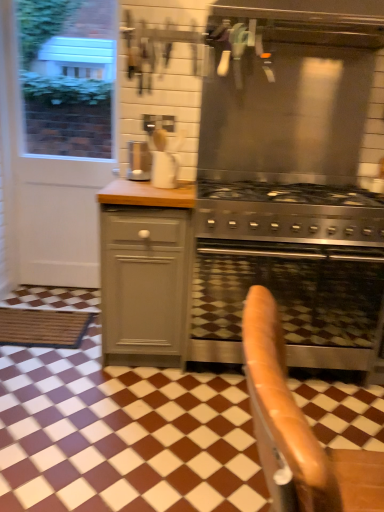
Measure the distance between point (145, 176) and camera.

The depth of point (145, 176) is 2.28 meters.

Identify the location of white matte screen door at left. The width and height of the screenshot is (384, 512). (62, 148).

In terms of height, does leather armchair at center look taller or shorter compared to stainless steel vent at upper center?

In the image, leather armchair at center appears to be shorter than stainless steel vent at upper center.

Is leather armchair at center turned away from stainless steel vent at upper center?

No, leather armchair at center is not facing the opposite direction of stainless steel vent at upper center.

Consider the image. Is leather armchair at center wider or thinner than stainless steel vent at upper center?

In the image, leather armchair at center appears to be more narrow than stainless steel vent at upper center.

From a real-world perspective, relative to stainless steel vent at upper center, is leather armchair at center vertically above or below?

Clearly, from a real-world perspective, leather armchair at center is below stainless steel vent at upper center.

Considering the sizes of matte gray cabinet at center-left and stainless steel vent at upper center in the image, is matte gray cabinet at center-left wider or thinner than stainless steel vent at upper center?

Considering their sizes, matte gray cabinet at center-left looks slimmer than stainless steel vent at upper center.

Considering the positions of point (170, 276) and point (344, 122), is point (170, 276) closer or farther from the camera than point (344, 122)?

Clearly, point (170, 276) is closer to the camera than point (344, 122).

Is matte gray cabinet at center-left facing away from stainless steel vent at upper center?

No.

Can you tell me how much matte gray cabinet at center-left and stainless steel vent at upper center differ in facing direction?

There is a 0.435-degree angle between the facing directions of matte gray cabinet at center-left and stainless steel vent at upper center.

Visually, is stainless steel vent at upper center positioned to the left or to the right of white matte paper towel at center?

Based on their positions, stainless steel vent at upper center is located to the right of white matte paper towel at center.

From the picture: From a real-world perspective, is stainless steel vent at upper center positioned over white matte paper towel at center based on gravity?

Yes, from a real-world perspective, stainless steel vent at upper center is above white matte paper towel at center.

What's the angular difference between stainless steel vent at upper center and white matte paper towel at center's facing directions?

They differ by 1.01 degrees in their facing directions.

Based on the photo, which point is more forward, (218, 167) or (163, 167)?

The point (163, 167) is closer to the camera.

Which of these two, stainless steel oven at center or leather armchair at center, is wider?

stainless steel oven at center.

Can you confirm if stainless steel oven at center is positioned to the left of leather armchair at center?

No, stainless steel oven at center is not to the left of leather armchair at center.

Does stainless steel oven at center have a smaller size compared to leather armchair at center?

No, stainless steel oven at center is not smaller than leather armchair at center.

Who is bigger, white matte screen door at left or white matte paper towel at center?

With larger size is white matte screen door at left.

Is white matte screen door at left situated inside white matte paper towel at center or outside?

white matte screen door at left is not enclosed by white matte paper towel at center.

Does white matte screen door at left have a greater width compared to white matte paper towel at center?

In fact, white matte screen door at left might be narrower than white matte paper towel at center.

Which is behind, white matte screen door at left or white matte paper towel at center?

white matte screen door at left.

Can you confirm if stainless steel oven at center is thinner than white matte screen door at left?

Incorrect, the width of stainless steel oven at center is not less than that of white matte screen door at left.

Is stainless steel oven at center closer to the viewer compared to white matte screen door at left?

Yes, it is.

Could white matte screen door at left be considered to be inside stainless steel oven at center?

That's incorrect, white matte screen door at left is not inside stainless steel oven at center.

Consider the image. Considering the sizes of objects stainless steel oven at center and white matte screen door at left in the image provided, who is taller, stainless steel oven at center or white matte screen door at left?

white matte screen door at left.

Is point (213, 96) closer to camera compared to point (142, 144)?

Yes.

Is stainless steel vent at upper center aimed at satin silver coffee machine at center?

No, stainless steel vent at upper center is not turned towards satin silver coffee machine at center.

Which object is wider, stainless steel vent at upper center or satin silver coffee machine at center?

stainless steel vent at upper center is wider.

You are a GUI agent. You are given a task and a screenshot of the screen. Output one action in this format:
    pyautogui.click(x=<x>, y=<y>)
    Task: Click on the coffee machine below the stainless steel vent at upper center (from the image's perspective)
    
    Given the screenshot: What is the action you would take?
    pyautogui.click(x=139, y=161)

The image size is (384, 512). Find the location of `armchair that appears on the left of stainless steel vent at upper center`. armchair that appears on the left of stainless steel vent at upper center is located at coordinates (282, 414).

You are a GUI agent. You are given a task and a screenshot of the screen. Output one action in this format:
    pyautogui.click(x=<x>, y=<y>)
    Task: Click on the vent above the matte gray cabinet at center-left (from the image's perspective)
    This screenshot has height=512, width=384.
    Given the screenshot: What is the action you would take?
    pyautogui.click(x=293, y=92)

From the image, which object appears to be farther from leather armchair at center, stainless steel oven at center or satin silver coffee machine at center?

satin silver coffee machine at center lies further to leather armchair at center than the other object.

Looking at the image, which one is located further to white matte paper towel at center, satin silver coffee machine at center or white matte screen door at left?

white matte screen door at left lies further to white matte paper towel at center than the other object.

Based on their spatial positions, is leather armchair at center or stainless steel vent at upper center closer to white matte paper towel at center?

stainless steel vent at upper center lies closer to white matte paper towel at center than the other object.

Looking at this image, when comparing their distances from white matte paper towel at center, does leather armchair at center or matte gray cabinet at center-left seem further?

leather armchair at center.

Estimate the real-world distances between objects in this image. Which object is further from stainless steel vent at upper center, white matte paper towel at center or satin silver coffee machine at center?

satin silver coffee machine at center lies further to stainless steel vent at upper center than the other object.

Based on their spatial positions, is stainless steel vent at upper center or stainless steel oven at center further from leather armchair at center?

stainless steel vent at upper center is further to leather armchair at center.

From the picture: Which object lies further to the anchor point satin silver coffee machine at center, matte gray cabinet at center-left or white matte screen door at left?

white matte screen door at left is positioned further to the anchor satin silver coffee machine at center.

When comparing their distances from matte gray cabinet at center-left, does stainless steel oven at center or stainless steel vent at upper center seem further?

Among the two, stainless steel vent at upper center is located further to matte gray cabinet at center-left.

Where is `kitchen appliance positioned between leather armchair at center and satin silver coffee machine at center from near to far`? The width and height of the screenshot is (384, 512). kitchen appliance positioned between leather armchair at center and satin silver coffee machine at center from near to far is located at coordinates (164, 170).

Locate an element on the screen. kitchen appliance situated between matte gray cabinet at center-left and stainless steel vent at upper center from left to right is located at coordinates pos(164,170).

At what (x,y) coordinates should I click in order to perform the action: click on oven located between leather armchair at center and white matte screen door at left in the depth direction. Please return your answer as a coordinate pair (x, y). This screenshot has height=512, width=384. Looking at the image, I should click on (289, 300).

Where is `cabinetry between leather armchair at center and satin silver coffee machine at center along the z-axis`? cabinetry between leather armchair at center and satin silver coffee machine at center along the z-axis is located at coordinates (145, 272).